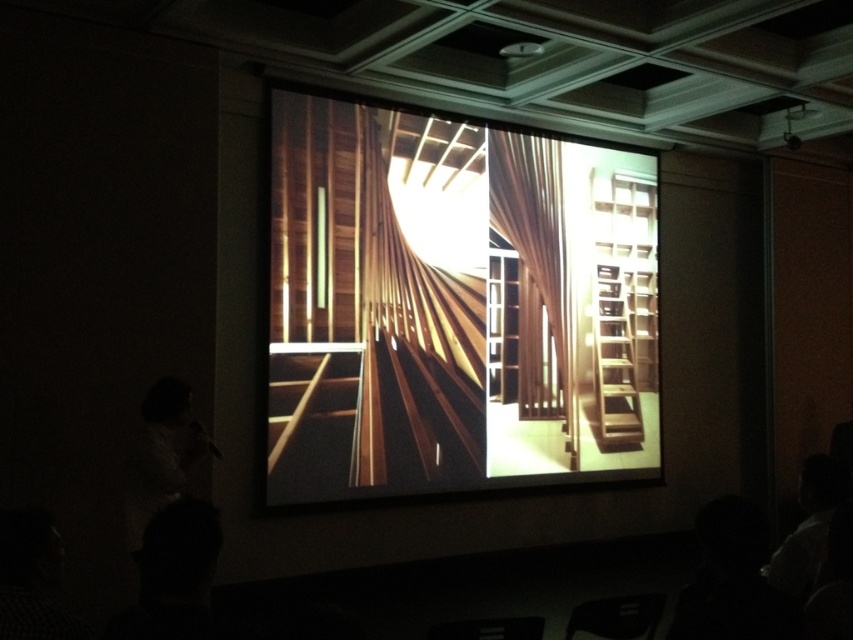
You are an architect reviewing a design displayed on the projection screen during a presentation. You notice two wooden elements labeled wooden slats at center and wooden at center. Which of these two elements appears larger in the design?

The wooden slats at center appears larger than the wooden at center in the design.

You are an architect reviewing a presentation about a wooden structure. The presentation shows wooden stairs at center and wooden at center. Which object in the presentation has a greater width?

The wooden stairs at center has a greater width than wooden at center because the wooden stairs at center surpasses wooden at center in width.